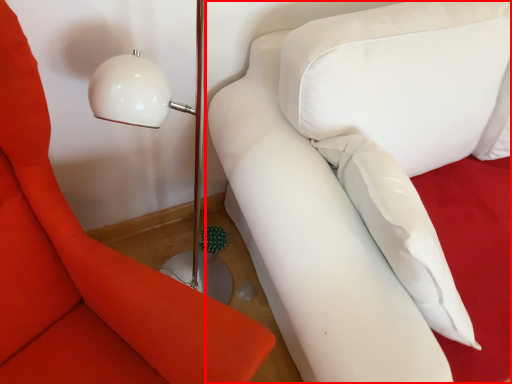
Question: Observing the image, what is the correct spatial positioning of studio couch (annotated by the red box) in reference to furniture?

Choices:
 (A) left
 (B) right

Answer: (B)